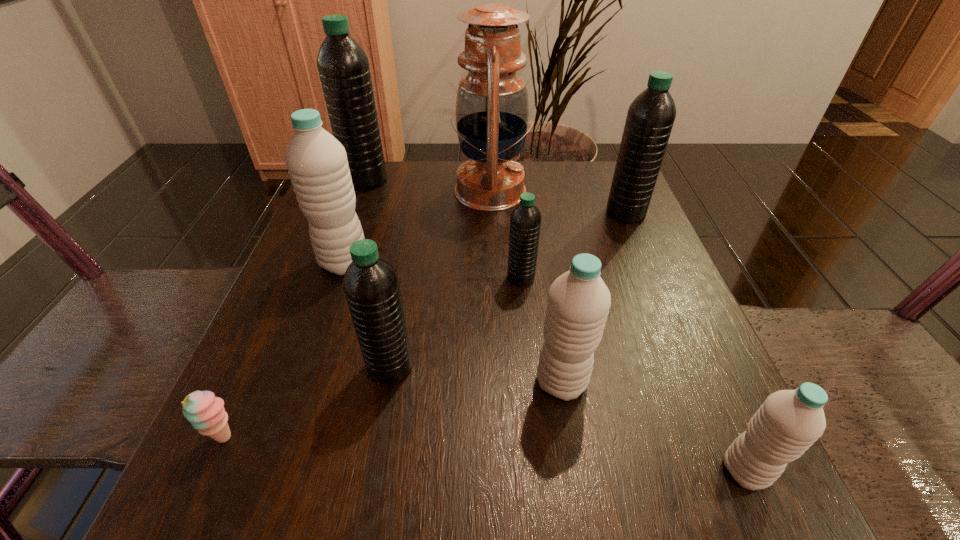
You are a GUI agent. You are given a task and a screenshot of the screen. Output one action in this format:
    pyautogui.click(x=<x>, y=<y>)
    Task: Click on the second closest white water bottle to the tallest water bottle
    Image resolution: width=960 pixels, height=540 pixels.
    Given the screenshot: What is the action you would take?
    pyautogui.click(x=578, y=304)

The height and width of the screenshot is (540, 960). Identify the location of the closest white water bottle to the second black water bottle from right to left. (578, 304).

Find the location of a particular element. This screenshot has height=540, width=960. free space in the image that satisfies the following two spatial constraints: 1. on the front side of the nearest white water bottle; 2. on the left side of the shortest object is located at coordinates (210, 470).

At what (x,y) coordinates should I click in order to perform the action: click on vacant area in the image that satisfies the following two spatial constraints: 1. on the back side of the rightmost black water bottle; 2. on the right side of the third black water bottle from left to right. Please return your answer as a coordinate pair (x, y). Image resolution: width=960 pixels, height=540 pixels. Looking at the image, I should click on (515, 213).

The image size is (960, 540). Find the location of `free space that satisfies the following two spatial constraints: 1. on the front side of the nearest white water bottle; 2. on the right side of the second biggest white water bottle`. free space that satisfies the following two spatial constraints: 1. on the front side of the nearest white water bottle; 2. on the right side of the second biggest white water bottle is located at coordinates (576, 470).